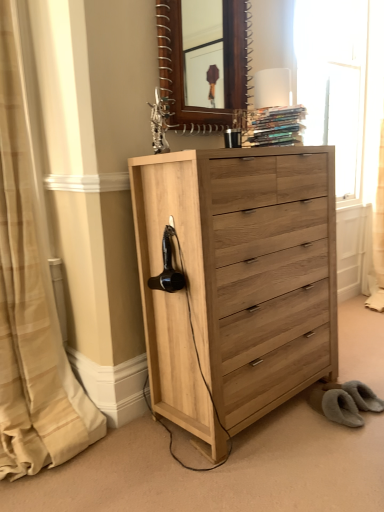
Question: From the image's perspective, relative to beige striped curtain at left, is hardcover books at upper center above or below?

Choices:
 (A) below
 (B) above

Answer: (B)

Question: Considering the positions of hardcover books at upper center and beige striped curtain at left in the image, is hardcover books at upper center bigger or smaller than beige striped curtain at left?

Choices:
 (A) small
 (B) big

Answer: (A)

Question: Estimate the real-world distances between objects in this image. Which object is closer to the black matte hair dryer at left?

Choices:
 (A) beige striped curtain at left
 (B) matte white table lamp at upper center
 (C) wooden mirror at upper center
 (D) hardcover books at upper center
 (E) natural wood chest of drawers at center

Answer: (E)

Question: Considering the real-world distances, which object is farthest from the beige striped curtain at left?

Choices:
 (A) wooden mirror at upper center
 (B) black matte hair dryer at left
 (C) matte white table lamp at upper center
 (D) transparent glass window at upper right
 (E) hardcover books at upper center

Answer: (A)